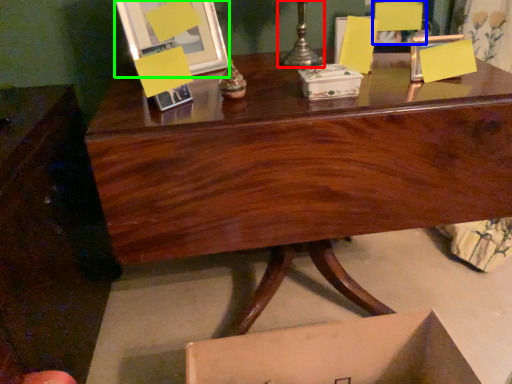
Question: Based on their relative distances, which object is farther from candle holder (highlighted by a red box)? Choose from armchair (highlighted by a blue box) and picture frame (highlighted by a green box).

Choices:
 (A) armchair
 (B) picture frame

Answer: (B)